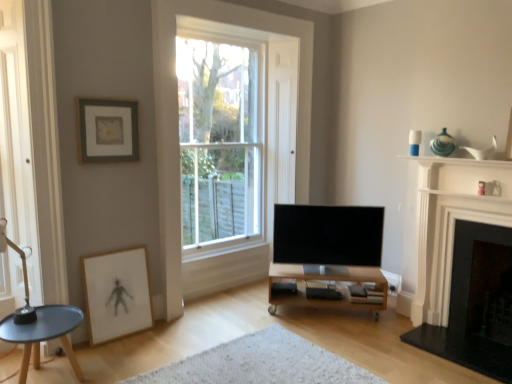
The image size is (512, 384). Describe the element at coordinates (326, 281) in the screenshot. I see `wooden tv stand at center` at that location.

What do you see at coordinates (481, 300) in the screenshot?
I see `dark gray stone fireplace at right, placed as the 2th fireplace when sorted from left to right` at bounding box center [481, 300].

What do you see at coordinates (457, 161) in the screenshot? The image size is (512, 384). I see `white glossy vase at upper right` at bounding box center [457, 161].

In order to face white textured rug at center, should I rotate leftwards or rightwards?

To align with it, rotate left about 0.347°.

Find the location of a particular element. black matte speaker at lower center is located at coordinates (284, 288).

The height and width of the screenshot is (384, 512). What do you see at coordinates (284, 288) in the screenshot?
I see `black matte speaker at lower center` at bounding box center [284, 288].

Describe the element at coordinates (465, 266) in the screenshot. I see `white marble fireplace at right, which is the second fireplace from right to left` at that location.

This screenshot has width=512, height=384. Identify the location of wooden tv stand at center. (326, 281).

Is white glossy vase at upper right far away from matte white picture frame at lower left, positioned as the 1th picture frame in bottom-to-top order?

Yes, white glossy vase at upper right is far from matte white picture frame at lower left, positioned as the 1th picture frame in bottom-to-top order.

Which of these two, white glossy vase at upper right or matte white picture frame at lower left, arranged as the 2th picture frame when viewed from the top, is wider?

white glossy vase at upper right is wider.

Locate an element on the screen. This screenshot has height=384, width=512. window sill on the right side of matte white picture frame at lower left, arranged as the 2th picture frame when viewed from the top is located at coordinates (457, 161).

Consider the image. In the image, is flat screen tv at center positioned in front of or behind matte gray picture frame at upper left, placed as the first picture frame when sorted from top to bottom?

flat screen tv at center is positioned farther from the viewer than matte gray picture frame at upper left, placed as the first picture frame when sorted from top to bottom.

From the picture: Does flat screen tv at center have a larger size compared to matte gray picture frame at upper left, placed as the first picture frame when sorted from top to bottom?

Indeed, flat screen tv at center has a larger size compared to matte gray picture frame at upper left, placed as the first picture frame when sorted from top to bottom.

Considering the positions of point (370, 209) and point (96, 159), is point (370, 209) closer or farther from the camera than point (96, 159)?

Clearly, point (370, 209) is more distant from the camera than point (96, 159).

In the scene shown: Is flat screen tv at center to the left or to the right of matte gray picture frame at upper left, placed as the first picture frame when sorted from top to bottom, in the image?

Clearly, flat screen tv at center is on the right of matte gray picture frame at upper left, placed as the first picture frame when sorted from top to bottom, in the image.

Do you think flat screen tv at center is within black matte speaker at lower center, or outside of it?

flat screen tv at center is not enclosed by black matte speaker at lower center.

From the image's perspective, is flat screen tv at center above black matte speaker at lower center?

Indeed, from the image's perspective, flat screen tv at center is shown above black matte speaker at lower center.

Is flat screen tv at center taller than black matte speaker at lower center?

Correct, flat screen tv at center is much taller as black matte speaker at lower center.

Measure the distance from flat screen tv at center to black matte speaker at lower center.

21.59 inches.

Is matte gray picture frame at upper left, placed as the first picture frame when sorted from top to bottom, further to the viewer compared to wooden tv stand at center?

Result: No.

Consider the image. Between matte gray picture frame at upper left, marked as the second picture frame in a bottom-to-top arrangement, and wooden tv stand at center, which one has less height?

wooden tv stand at center.

Is matte gray picture frame at upper left, placed as the first picture frame when sorted from top to bottom, not within wooden tv stand at center?

matte gray picture frame at upper left, placed as the first picture frame when sorted from top to bottom, lies outside wooden tv stand at center's area.

What's the angular difference between black matte speaker at lower center and clear glass window at center's facing directions?

black matte speaker at lower center and clear glass window at center are facing 46.1 degrees away from each other.

I want to click on window in front of the black matte speaker at lower center, so click(220, 139).

Considering the relative sizes of black matte speaker at lower center and clear glass window at center in the image provided, is black matte speaker at lower center taller than clear glass window at center?

No, black matte speaker at lower center is not taller than clear glass window at center.

Is black matte speaker at lower center bigger or smaller than clear glass window at center?

Clearly, black matte speaker at lower center is smaller in size than clear glass window at center.

Considering the relative positions of white textured rug at center and wooden tv stand at center in the image provided, is white textured rug at center in front of wooden tv stand at center?

Yes, the depth of white textured rug at center is less than that of wooden tv stand at center.

From a real-world perspective, between white textured rug at center and wooden tv stand at center, who is vertically higher?

In real-world perspective, wooden tv stand at center is above.

How different are the orientations of white textured rug at center and wooden tv stand at center in degrees?

The angle between the facing direction of white textured rug at center and the facing direction of wooden tv stand at center is 47.5 degrees.

Looking at their sizes, would you say white textured rug at center is wider or thinner than wooden tv stand at center?

In the image, white textured rug at center appears to be wider than wooden tv stand at center.

Is dark gray stone fireplace at right, placed as the 2th fireplace when sorted from left to right, oriented towards wooden tv stand at center?

No, dark gray stone fireplace at right, placed as the 2th fireplace when sorted from left to right, is not aimed at wooden tv stand at center.

Can you tell me how much dark gray stone fireplace at right, which is counted as the 1th fireplace, starting from the right, and wooden tv stand at center differ in facing direction?

46.4 degrees.

Who is shorter, dark gray stone fireplace at right, which is counted as the 1th fireplace, starting from the right, or wooden tv stand at center?

With less height is wooden tv stand at center.

From the image's perspective, which is below, dark gray stone fireplace at right, placed as the 2th fireplace when sorted from left to right, or wooden tv stand at center?

wooden tv stand at center.

At what (x,y) coordinates should I click in order to perform the action: click on the 1st picture frame to the left when counting from the white glossy vase at upper right. Please return your answer as a coordinate pair (x, y). The image size is (512, 384). Looking at the image, I should click on (116, 294).

The width and height of the screenshot is (512, 384). What are the coordinates of `television behind the matte gray picture frame at upper left, marked as the second picture frame in a bottom-to-top arrangement` in the screenshot? It's located at (328, 235).

Estimate the real-world distances between objects in this image. Which object is further from clear glass window at center, white marble fireplace at right, which is the second fireplace from right to left, or matte black coffee table at lower left?

The object further to clear glass window at center is white marble fireplace at right, which is the second fireplace from right to left.

When comparing their distances from matte black coffee table at lower left, does matte gray picture frame at upper left, placed as the first picture frame when sorted from top to bottom, or white glossy vase at upper right seem further?

The object further to matte black coffee table at lower left is white glossy vase at upper right.

Consider the image. Considering their positions, is matte white picture frame at lower left, positioned as the 1th picture frame in bottom-to-top order, positioned further to clear glass window at center than flat screen tv at center?

Among the two, matte white picture frame at lower left, positioned as the 1th picture frame in bottom-to-top order, is located further to clear glass window at center.

From the image, which object appears to be nearer to white glossy vase at upper right, flat screen tv at center or dark gray stone fireplace at right, placed as the 2th fireplace when sorted from left to right?

flat screen tv at center is positioned closer to the anchor white glossy vase at upper right.

Consider the image. Estimate the real-world distances between objects in this image. Which object is further from matte gray picture frame at upper left, marked as the second picture frame in a bottom-to-top arrangement, white glossy vase at upper right or dark gray stone fireplace at right, which is counted as the 1th fireplace, starting from the right?

Based on the image, dark gray stone fireplace at right, which is counted as the 1th fireplace, starting from the right, appears to be further to matte gray picture frame at upper left, marked as the second picture frame in a bottom-to-top arrangement.

Looking at this image, from the image, which object appears to be farther from matte black coffee table at lower left, black matte speaker at lower center or matte gray picture frame at upper left, placed as the first picture frame when sorted from top to bottom?

black matte speaker at lower center is further to matte black coffee table at lower left.

From the image, which object appears to be farther from matte gray picture frame at upper left, placed as the first picture frame when sorted from top to bottom, clear glass window at center or white textured rug at center?

Among the two, clear glass window at center is located further to matte gray picture frame at upper left, placed as the first picture frame when sorted from top to bottom.

When comparing their distances from black matte speaker at lower center, does clear glass window at center or matte white picture frame at lower left, arranged as the 2th picture frame when viewed from the top, seem further?

clear glass window at center lies further to black matte speaker at lower center than the other object.

Where is `television between white textured rug at center and clear glass window at center from front to back`? The width and height of the screenshot is (512, 384). television between white textured rug at center and clear glass window at center from front to back is located at coordinates (328, 235).

What are the coordinates of `television between matte white picture frame at lower left, arranged as the 2th picture frame when viewed from the top, and white glossy vase at upper right from left to right` in the screenshot? It's located at (328, 235).

Where is `plain between matte black coffee table at lower left and white marble fireplace at right, which is the 1th fireplace from left to right, in the horizontal direction`? This screenshot has height=384, width=512. plain between matte black coffee table at lower left and white marble fireplace at right, which is the 1th fireplace from left to right, in the horizontal direction is located at coordinates (261, 363).

Locate an element on the screen. picture frame located between matte gray picture frame at upper left, placed as the first picture frame when sorted from top to bottom, and white marble fireplace at right, which is the second fireplace from right to left, in the left-right direction is located at coordinates (116, 294).